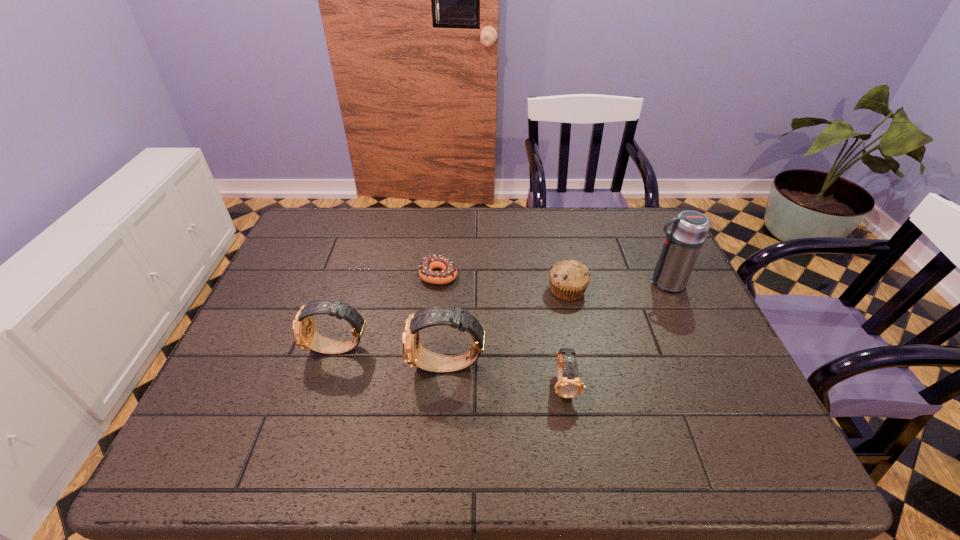
What are the coordinates of `free space between the shortest watch and the tallest object` in the screenshot? It's located at (615, 334).

I want to click on blank region between the doughnut and the rightmost watch, so [501, 330].

The image size is (960, 540). In order to click on object that is the fifth closest to the muffin in this screenshot , I will do `click(305, 335)`.

Choose which object is the third nearest neighbor to the second shortest watch. Please provide its 2D coordinates. Your answer should be formatted as a tuple, i.e. [(x, y)], where the tuple contains the x and y coordinates of a point satisfying the conditions above.

[(569, 385)]

This screenshot has height=540, width=960. I want to click on watch that stands as the closest to the leftmost watch, so click(x=414, y=354).

The height and width of the screenshot is (540, 960). Find the location of `watch that is the third closest to the rightmost object`. watch that is the third closest to the rightmost object is located at coordinates (305, 335).

You are a GUI agent. You are given a task and a screenshot of the screen. Output one action in this format:
    pyautogui.click(x=<x>, y=<y>)
    Task: Click on the free spot that satisfies the following two spatial constraints: 1. with a handle on the side of the rightmost object; 2. on the face of the rightmost watch
    
    Given the screenshot: What is the action you would take?
    pyautogui.click(x=712, y=385)